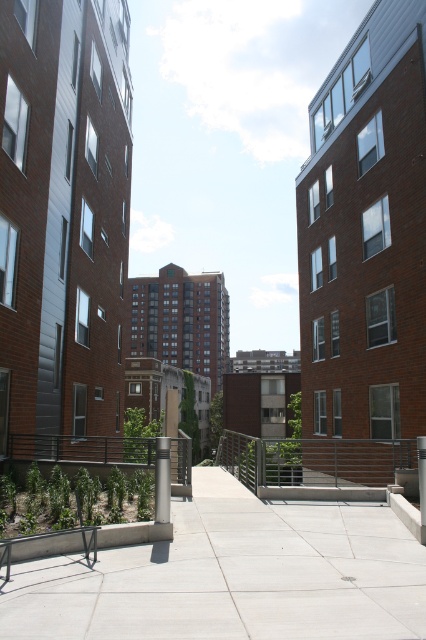
Which of these two, gray concrete pavement at center or satin silver post at center, stands shorter?

With less height is gray concrete pavement at center.

Is point (46, 602) positioned after point (164, 464)?

No, it is not.

Between point (363, 628) and point (166, 500), which one is positioned in front?

Point (363, 628) is more forward.

The height and width of the screenshot is (640, 426). What are the coordinates of `gray concrete pavement at center` in the screenshot? It's located at (233, 576).

Looking at this image, does metallic silver balustrade at center have a lesser height compared to satin silver post at center?

No, metallic silver balustrade at center is not shorter than satin silver post at center.

Between metallic silver balustrade at center and satin silver post at center, which one appears on the left side from the viewer's perspective?

Positioned to the left is satin silver post at center.

What do you see at coordinates (313, 460) in the screenshot?
I see `metallic silver balustrade at center` at bounding box center [313, 460].

The width and height of the screenshot is (426, 640). I want to click on metallic silver balustrade at center, so click(313, 460).

Between gray concrete pavement at center and metallic silver balustrade at center, which one is positioned lower?

metallic silver balustrade at center is below.

Is point (51, 596) positioned after point (301, 458)?

That is False.

Where is `gray concrete pavement at center`? gray concrete pavement at center is located at coordinates point(233,576).